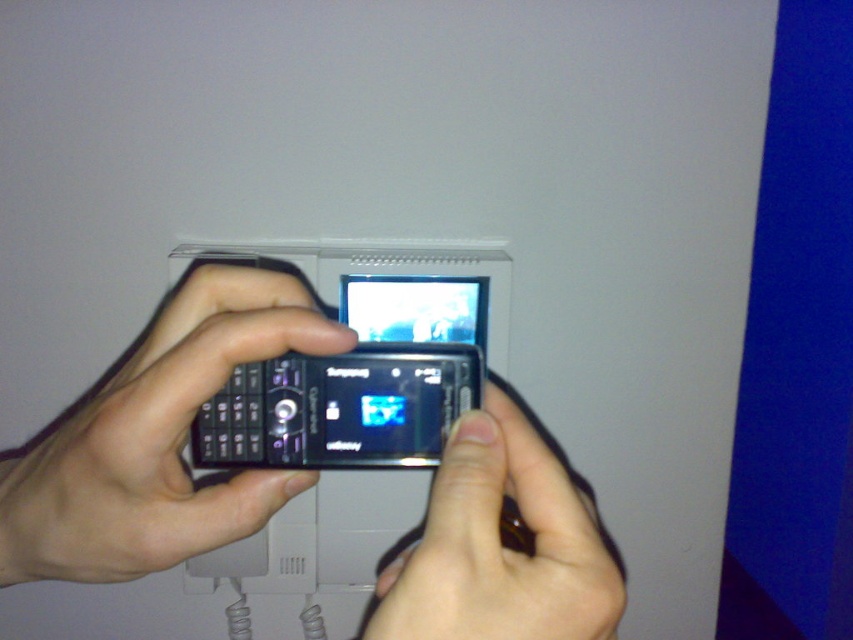
You are trying to decide which phone to place in a narrow pocket of your bag. The black glossy phone at center and the matte black phone at center are both options. Based on their sizes, which one would fit better?

The matte black phone at center has a smaller width compared to the black glossy phone at center, so it would fit better in the narrow pocket of the bag.

What object is located at the coordinates point (155, 440) in the image?

The point (155, 440) corresponds to the black glossy phone at center.